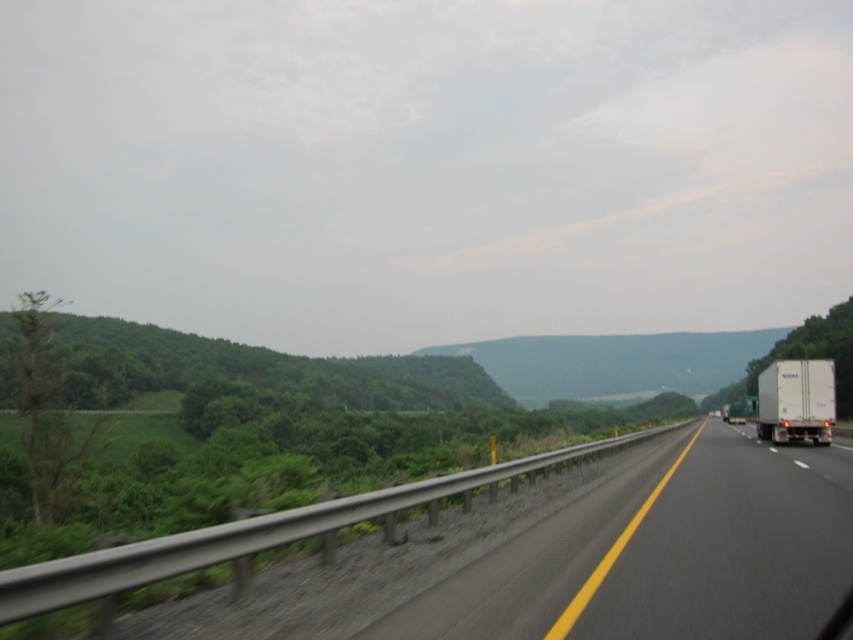
You are a driver approaching the black asphalt highway at center and see the white matte trailer truck at right. Which object takes up more space in the image?

The white matte trailer truck at right occupies more space in the image than the black asphalt highway at center.

You are driving a car that is 14 feet long. You want to safely pass a stopped white semi truck on the highway. Can your car fit entirely within the black asphalt highway at center while passing?

The distance between the black asphalt highway at center and the camera is 15.62 feet. Since your car is 14 feet long, it can fit within this space as 14 feet is less than 15.62 feet.